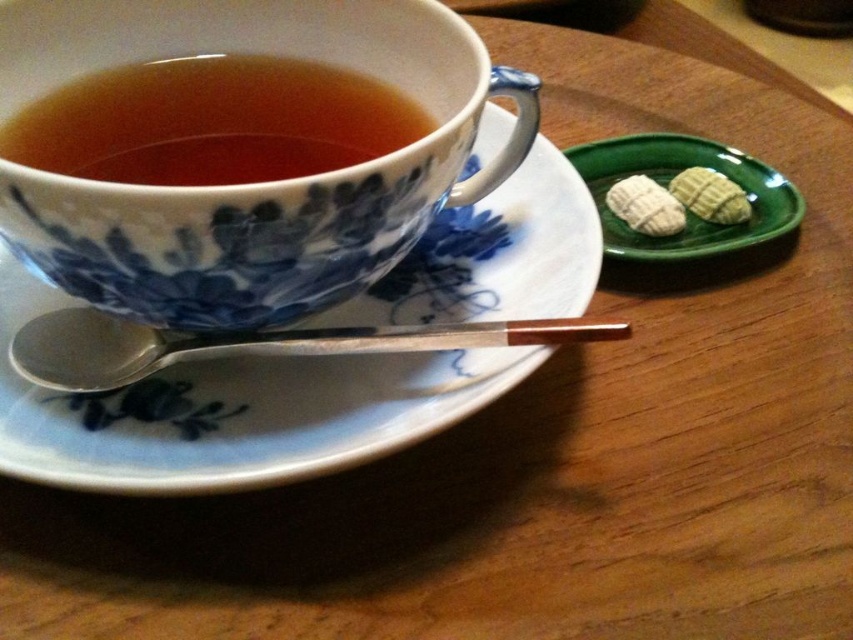
You are a tea enthusiast who wants to grab the white textured cookies at upper right from where you are standing. The silver metallic spoon at lower left is blocking your path. Can you reach the cookies without moving the spoon?

The distance between the silver metallic spoon at lower left and the white textured cookies at upper right is 12.70 inches. Since the spoon is blocking your path, you would need to move it to reach the cookies. However, if you can extend your hand around the spoon, the 12.70 inches gap might allow access without moving it, but this depends on your reach capability.

Consider the image. You are arranging a tea set on a table and need to place a white porcelain saucer at upper left. Based on the coordinates provided, where should you position it relative to the center of the table?

The white porcelain saucer at upper left should be positioned at coordinates point (x=231, y=412) relative to the center of the table.

You are a guest at a tea party and need to decide whether to pick up the silver metallic spoon at lower left or the white textured cookies at upper right first. Which item is larger in size?

The silver metallic spoon at lower left is bigger than the white textured cookies at upper right, so you should pick up the silver metallic spoon at lower left first.